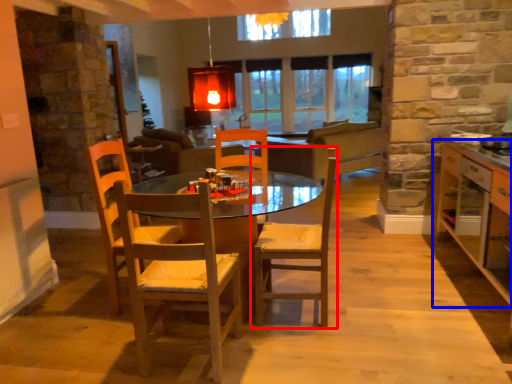
Question: Which point is further to the camera, chair (highlighted by a red box) or cabinetry (highlighted by a blue box)?

Choices:
 (A) chair
 (B) cabinetry

Answer: (A)